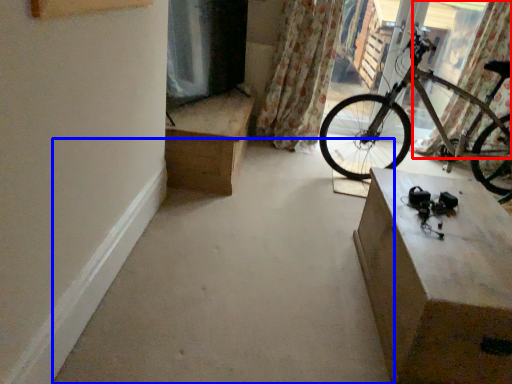
Question: Which object is further to the camera taking this photo, curtain (highlighted by a red box) or concrete (highlighted by a blue box)?

Choices:
 (A) curtain
 (B) concrete

Answer: (A)